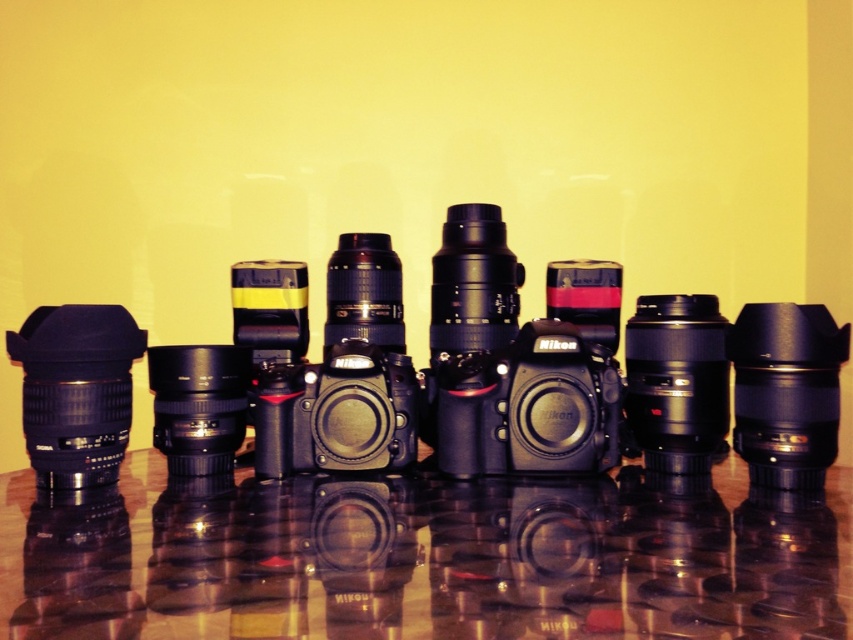
Question: Does matte black camera at center come in front of glossy reflective table at center?

Choices:
 (A) yes
 (B) no

Answer: (B)

Question: Estimate the real-world distances between objects in this image. Which object is closer to the matte black lens at left?

Choices:
 (A) glossy reflective table at center
 (B) matte black camera at center

Answer: (B)

Question: Does glossy reflective table at center lie behind matte black lens at left?

Choices:
 (A) no
 (B) yes

Answer: (A)

Question: Which object appears closest to the camera in this image?

Choices:
 (A) glossy reflective table at center
 (B) matte black camera at center

Answer: (A)

Question: Is matte black camera at center closer to the viewer compared to glossy reflective table at center?

Choices:
 (A) no
 (B) yes

Answer: (A)

Question: Which object appears closest to the camera in this image?

Choices:
 (A) matte black camera at center
 (B) glossy reflective table at center

Answer: (B)